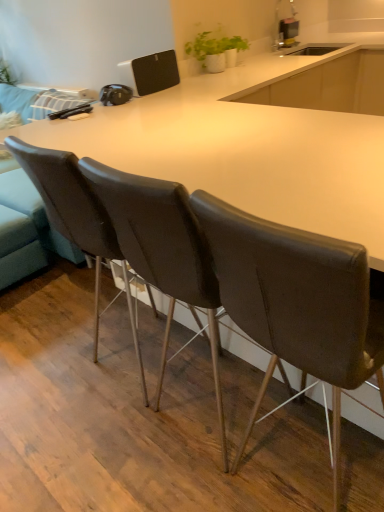
Image resolution: width=384 pixels, height=512 pixels. I want to click on vacant area to the left of leather at left, which appears as the 1th chair when viewed from the left, so click(x=58, y=376).